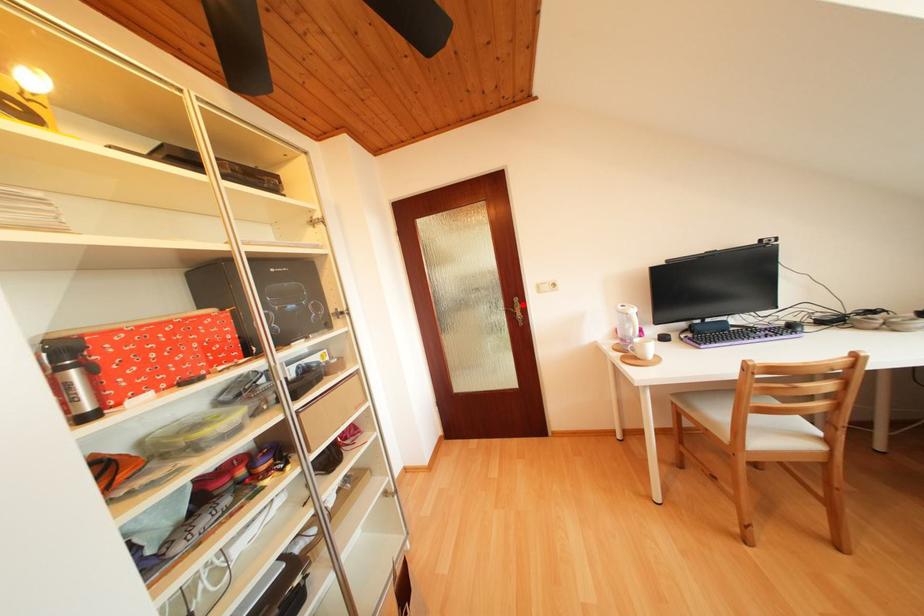
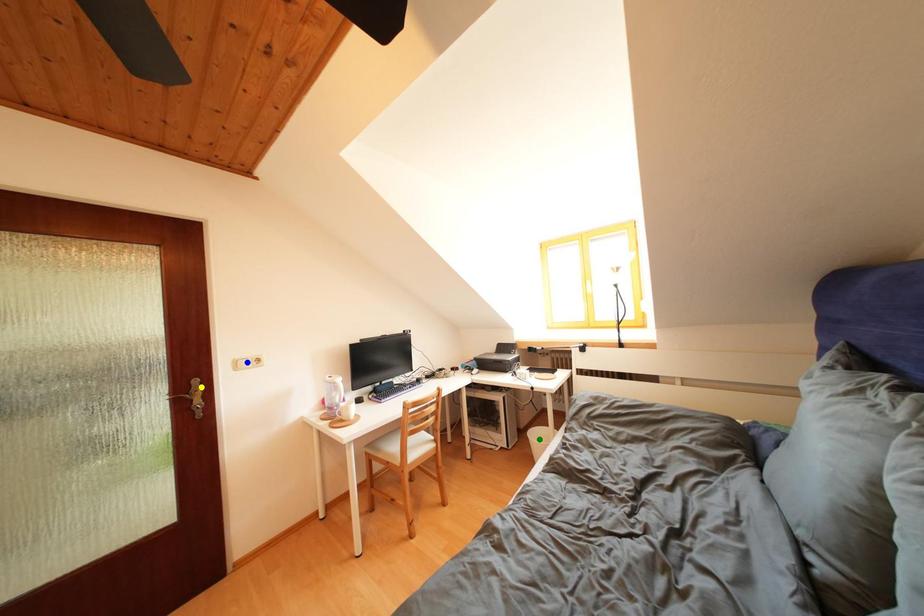
Question: I am providing you with two images of the same scene from different viewpoints. A red point is marked on the first image. You are given multiple points on the second image. Which point in image 2 represents the same 3d spot as the red point in image 1?

Choices:
 (A) green point
 (B) blue point
 (C) yellow point

Answer: (C)